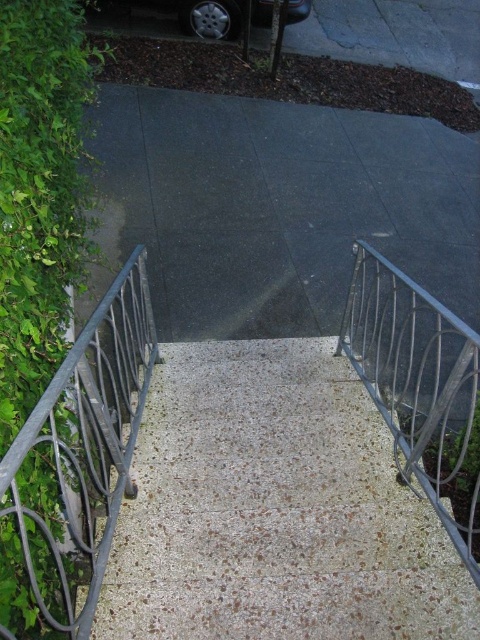
From the picture: Can you confirm if green leafy hedge at left is bigger than dark gray wrought iron at left?

Incorrect, green leafy hedge at left is not larger than dark gray wrought iron at left.

The height and width of the screenshot is (640, 480). I want to click on green leafy hedge at left, so pos(37,193).

Where is `green leafy hedge at left`? green leafy hedge at left is located at coordinates (37, 193).

Which of these two, green leafy hedge at left or silver metallic car at upper center, stands taller?

With more height is green leafy hedge at left.

Looking at this image, is green leafy hedge at left further to the viewer compared to silver metallic car at upper center?

No, it is in front of silver metallic car at upper center.

Image resolution: width=480 pixels, height=640 pixels. Identify the location of green leafy hedge at left. (37, 193).

Locate an element on the screen. green leafy hedge at left is located at coordinates (37, 193).

Who is positioned more to the left, dark gray wrought iron at left or silver metallic car at upper center?

dark gray wrought iron at left

This screenshot has height=640, width=480. What do you see at coordinates (86, 440) in the screenshot?
I see `dark gray wrought iron at left` at bounding box center [86, 440].

Locate an element on the screen. The width and height of the screenshot is (480, 640). dark gray wrought iron at left is located at coordinates (86, 440).